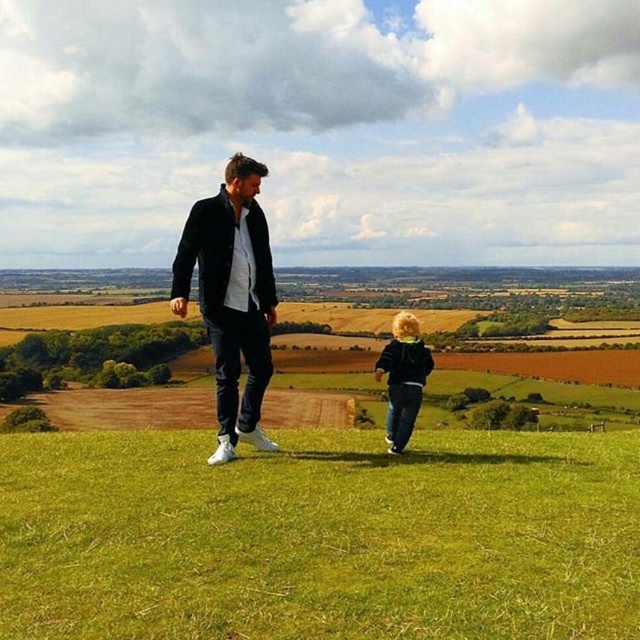
Question: Which of the following is the closest to the observer?

Choices:
 (A) (342, 500)
 (B) (388, 433)

Answer: (A)

Question: Does green grass at center have a larger size compared to matte black hoodie at center?

Choices:
 (A) no
 (B) yes

Answer: (A)

Question: Which object appears farthest from the camera in this image?

Choices:
 (A) matte black hoodie at center
 (B) green grass at center
 (C) black matte jacket at center

Answer: (A)

Question: Does black matte jacket at center appear over matte black hoodie at center?

Choices:
 (A) yes
 (B) no

Answer: (A)

Question: Among these objects, which one is farthest from the camera?

Choices:
 (A) black matte jacket at center
 (B) green grass at center
 (C) matte black hoodie at center

Answer: (C)

Question: Is green grass at center positioned in front of black matte jacket at center?

Choices:
 (A) yes
 (B) no

Answer: (A)